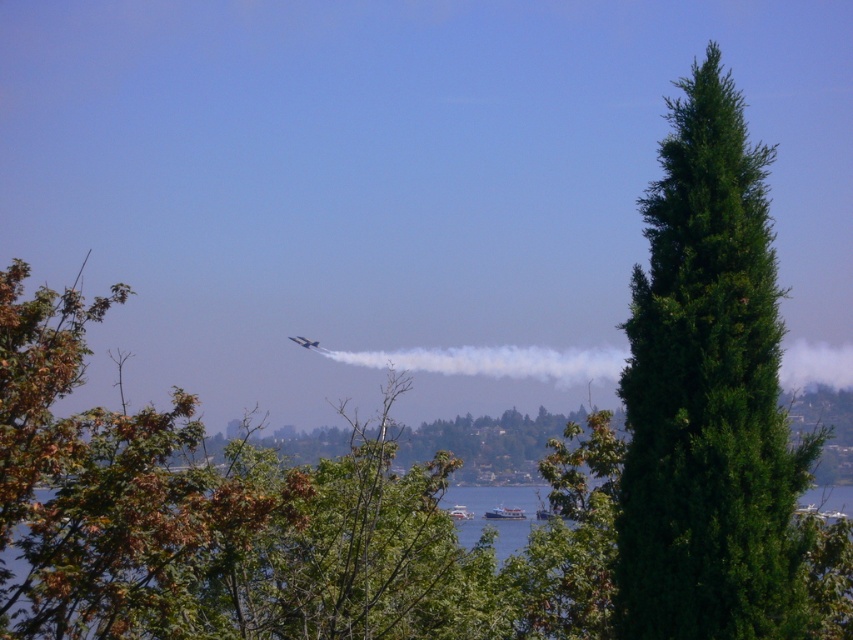
Question: Which object appears closest to the camera in this image?

Choices:
 (A) white vapor trail at center
 (B) white glossy boat at lower center

Answer: (B)

Question: Is green leafy tree at center right to the right of white plastic boat at lower center from the viewer's perspective?

Choices:
 (A) no
 (B) yes

Answer: (A)

Question: Among these points, which one is farthest from the camera?

Choices:
 (A) (462, 512)
 (B) (838, 611)
 (C) (790, 588)

Answer: (A)

Question: Can you confirm if green leafy tree at center is smaller than white vapor trail at center?

Choices:
 (A) yes
 (B) no

Answer: (B)

Question: Is green leafy tree at center bigger than metallic silver airplane at center?

Choices:
 (A) no
 (B) yes

Answer: (B)

Question: Which point is farther from the camera taking this photo?

Choices:
 (A) (521, 516)
 (B) (451, 513)
 (C) (312, 348)

Answer: (C)